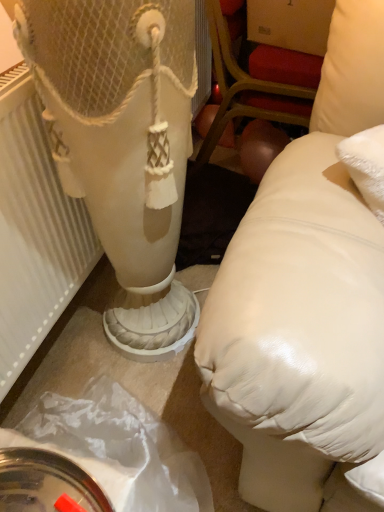
Question: Is white textured radiator at left not within matte white pillow at right?

Choices:
 (A) no
 (B) yes

Answer: (B)

Question: From a real-world perspective, is white textured radiator at left on top of matte white pillow at right?

Choices:
 (A) no
 (B) yes

Answer: (B)

Question: Does white textured radiator at left have a smaller size compared to matte white pillow at right?

Choices:
 (A) yes
 (B) no

Answer: (A)

Question: Considering the relative positions of white textured radiator at left and matte white pillow at right in the image provided, is white textured radiator at left in front of matte white pillow at right?

Choices:
 (A) yes
 (B) no

Answer: (A)

Question: From a real-world perspective, is white textured radiator at left physically below matte white pillow at right?

Choices:
 (A) yes
 (B) no

Answer: (B)

Question: Is matte white pillow at right at the back of white textured radiator at left?

Choices:
 (A) yes
 (B) no

Answer: (B)

Question: Does matte white pillow at right have a greater width compared to white textured radiator at left?

Choices:
 (A) yes
 (B) no

Answer: (A)

Question: Considering the relative sizes of matte white pillow at right and white textured radiator at left in the image provided, is matte white pillow at right taller than white textured radiator at left?

Choices:
 (A) yes
 (B) no

Answer: (A)

Question: Could you tell me if matte white pillow at right is turned towards white textured radiator at left?

Choices:
 (A) no
 (B) yes

Answer: (A)

Question: Can you confirm if matte white pillow at right is thinner than white textured radiator at left?

Choices:
 (A) no
 (B) yes

Answer: (A)

Question: Is the depth of matte white pillow at right greater than that of white textured radiator at left?

Choices:
 (A) yes
 (B) no

Answer: (A)

Question: Can you confirm if matte white pillow at right is bigger than white textured radiator at left?

Choices:
 (A) no
 (B) yes

Answer: (B)

Question: Based on their positions, is white textured radiator at left located to the left or right of matte white pillow at right?

Choices:
 (A) right
 (B) left

Answer: (B)